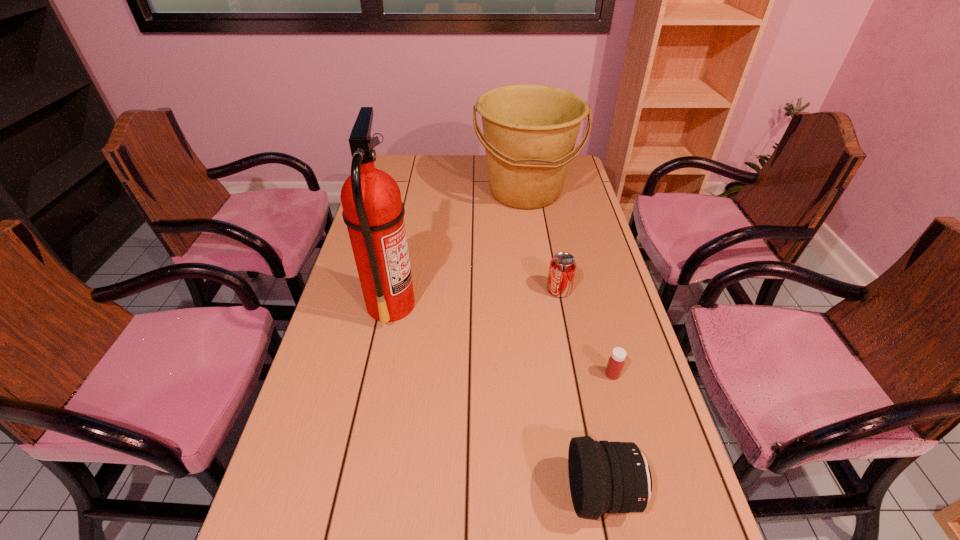
This screenshot has height=540, width=960. I want to click on the leftmost object, so click(373, 211).

Identify the location of fire extinguisher. (373, 211).

At what (x,y) coordinates should I click in order to perform the action: click on the second tallest object. Please return your answer as a coordinate pair (x, y). This screenshot has height=540, width=960. Looking at the image, I should click on (530, 130).

I want to click on bucket, so click(x=530, y=130).

Locate an element on the screen. The image size is (960, 540). the third shortest object is located at coordinates (607, 477).

Locate an element on the screen. Image resolution: width=960 pixels, height=540 pixels. the nearest object is located at coordinates (607, 477).

In order to click on soda can in this screenshot , I will do `click(562, 268)`.

Find the location of a particular element. The width and height of the screenshot is (960, 540). medicine is located at coordinates (616, 361).

The width and height of the screenshot is (960, 540). I want to click on the fourth farthest object, so [616, 361].

Locate an element on the screen. This screenshot has width=960, height=540. vacant space situated 0.140m on the side of the tallest object near the handle is located at coordinates (466, 304).